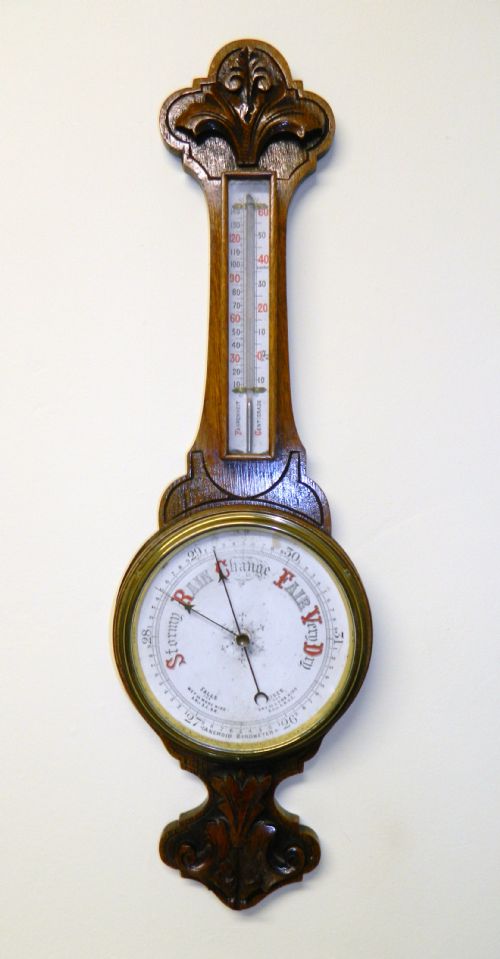
Image resolution: width=500 pixels, height=959 pixels. I want to click on back wall, so click(72, 843), click(54, 235), click(408, 226), click(436, 835).